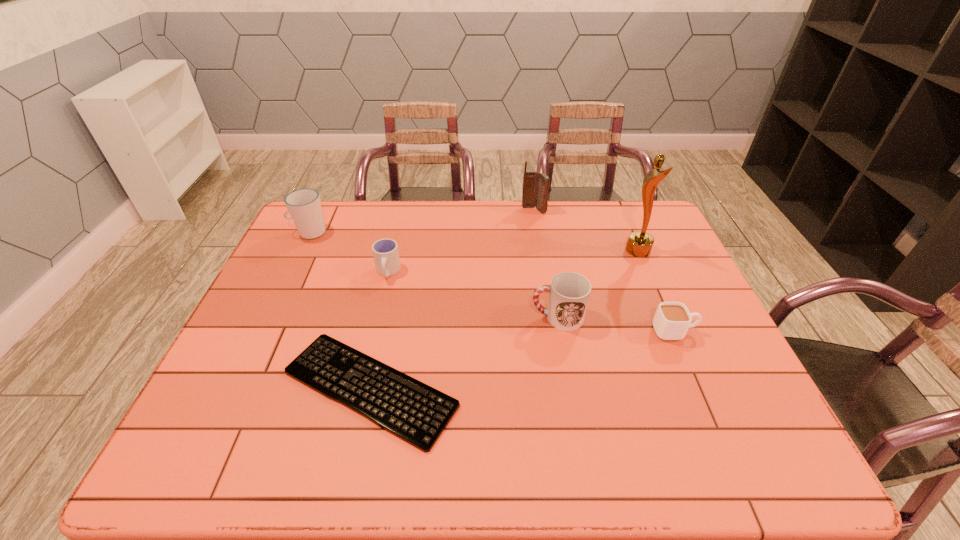
You are a GUI agent. You are given a task and a screenshot of the screen. Output one action in this format:
    pyautogui.click(x=<x>, y=<y>)
    Task: Click on the sixth tallest object
    The width and height of the screenshot is (960, 540).
    Given the screenshot: What is the action you would take?
    pyautogui.click(x=671, y=321)

Identify the location of the shortest object. (413, 411).

The image size is (960, 540). In order to click on free spot located 0.370m on the front-facing side of the award in this screenshot , I will do `click(509, 251)`.

You are a GUI agent. You are given a task and a screenshot of the screen. Output one action in this format:
    pyautogui.click(x=<x>, y=<y>)
    Task: Click on the vacant space situated 0.380m on the front-facing side of the award
    This screenshot has height=540, width=960.
    Given the screenshot: What is the action you would take?
    pyautogui.click(x=506, y=251)

At what (x,y) coordinates should I click in order to perform the action: click on free space located 0.180m on the front-facing side of the award. Please return your answer as a coordinate pair (x, y). Looking at the image, I should click on (569, 251).

The height and width of the screenshot is (540, 960). I want to click on blank area located 0.060m on the keyboard of the farthest object, so click(x=537, y=225).

What are the coordinates of `vacant space located 0.390m on the handle side of the second tallest cup` in the screenshot? It's located at (386, 317).

Find the location of a particular element. The image size is (960, 540). blank space located 0.380m on the handle side of the second tallest cup is located at coordinates (390, 317).

This screenshot has width=960, height=540. Find the location of `vacant space located on the handle side of the second tallest cup`. vacant space located on the handle side of the second tallest cup is located at coordinates (430, 317).

The image size is (960, 540). Find the location of `free location located 0.120m with the handle on the side of the second cup from left to right`. free location located 0.120m with the handle on the side of the second cup from left to right is located at coordinates (378, 314).